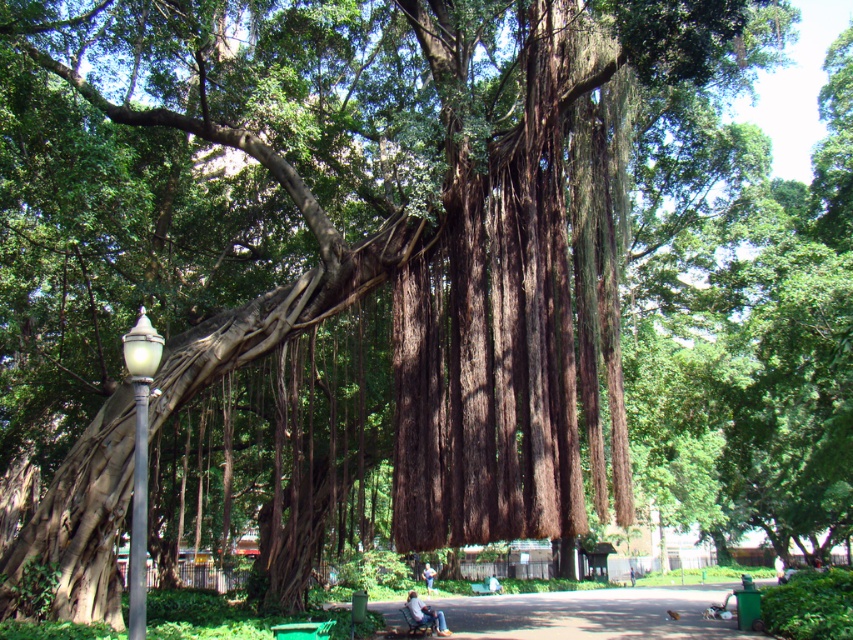
You are standing at the park and want to take a photo of the two points marked in the image. Which point, point (480, 637) or point (144, 333), is closer to your camera lens?

Point (480, 637) is further to the camera than point (144, 333), so the point closer to your camera lens is point (144, 333).